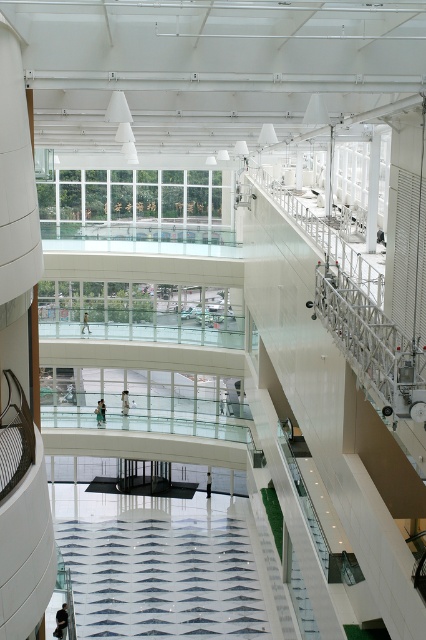
Can you confirm if white textured fabric at center is shorter than dark blue fabric jacket at lower left?

Incorrect, white textured fabric at center's height does not fall short of dark blue fabric jacket at lower left's.

Is point (132, 616) in front of point (60, 616)?

No.

Between point (137, 596) and point (60, 620), which one is positioned behind?

Point (137, 596)

This screenshot has width=426, height=640. I want to click on white textured fabric at center, so click(x=163, y=577).

Is white glossy pillar at left closer to the viewer compared to light brown wooden bench at center?

That is True.

Is point (28, 268) more distant than point (207, 490)?

No, (28, 268) is closer to viewer.

The width and height of the screenshot is (426, 640). What are the coordinates of `white glossy pillar at left` in the screenshot? It's located at (16, 212).

Between point (57, 634) and point (121, 397), which one is positioned behind?

Point (121, 397)

Identify the location of dark blue fabric jacket at lower left. This screenshot has width=426, height=640. (62, 621).

At what (x,y) coordinates should I click in order to perform the action: click on dark blue fabric jacket at lower left. Please return your answer as a coordinate pair (x, y). This screenshot has height=640, width=426. Looking at the image, I should click on (62, 621).